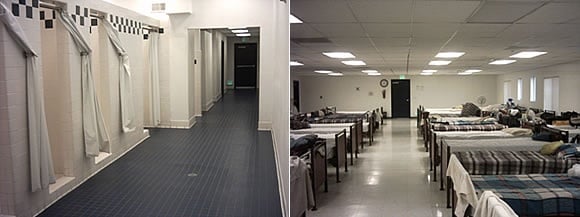
The width and height of the screenshot is (580, 217). In order to click on blanket in this screenshot , I will do `click(483, 185)`.